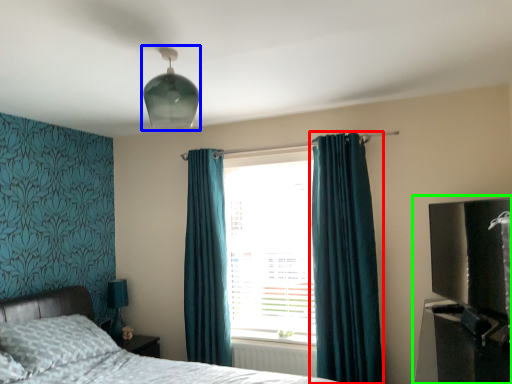
Question: Considering the real-world distances, which object is farthest from curtain (highlighted by a red box)? light fixture (highlighted by a blue box) or entertainment center (highlighted by a green box)?

Choices:
 (A) light fixture
 (B) entertainment center

Answer: (A)